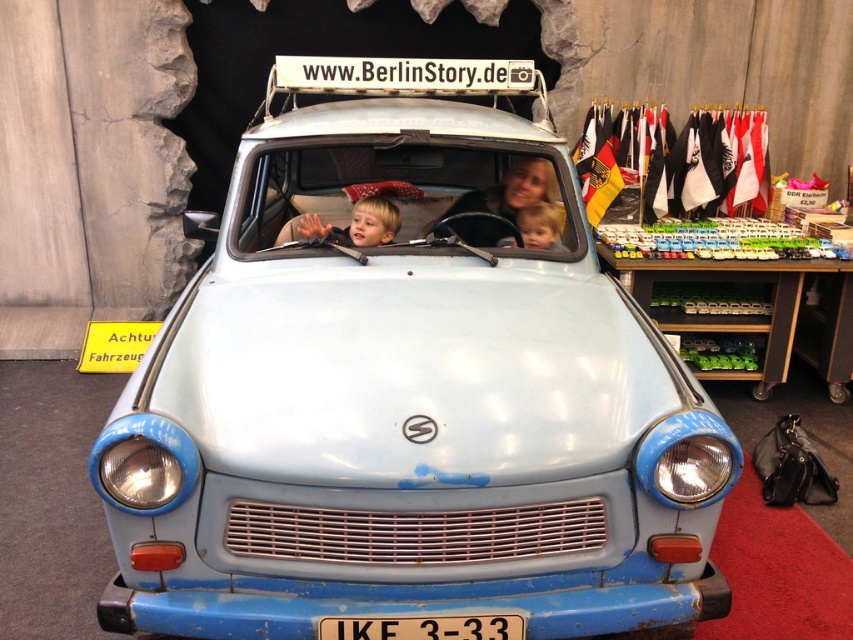
Does light blue matte car at center have a larger size compared to blonde hair child at center?

Yes, light blue matte car at center is bigger than blonde hair child at center.

Between point (563, 218) and point (535, 208), which one is positioned behind?

The point (535, 208) is more distant.

Where is `light blue matte car at center`? The width and height of the screenshot is (853, 640). light blue matte car at center is located at coordinates (408, 392).

Does black plastic license plate at center appear under matte blue boy at center?

Indeed, black plastic license plate at center is positioned under matte blue boy at center.

Which is behind, point (366, 625) or point (396, 211)?

Point (396, 211)

Identify the location of black plastic license plate at center. (422, 627).

Which is in front, point (349, 531) or point (323, 632)?

Point (323, 632) is in front.

This screenshot has height=640, width=853. Identify the location of light blue matte car at center. (408, 392).